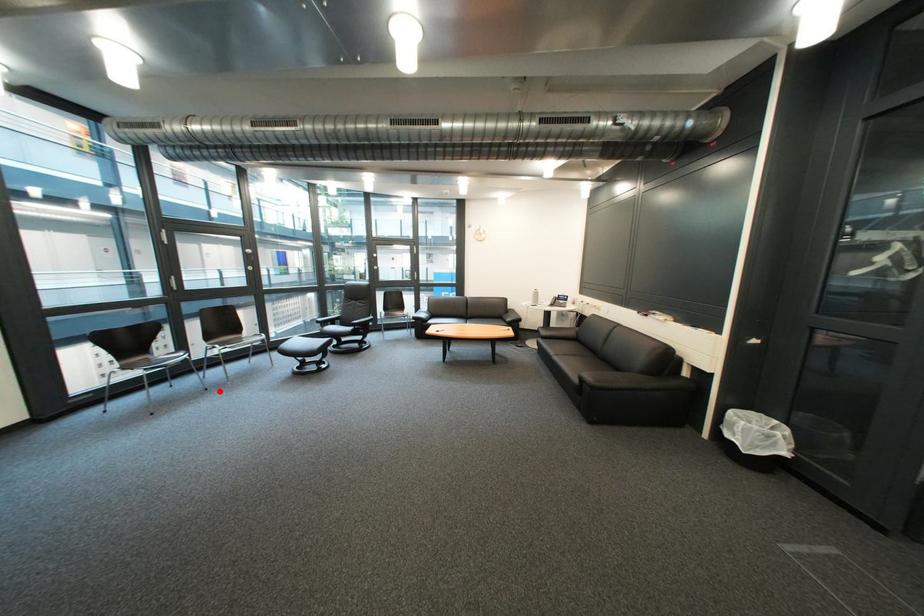
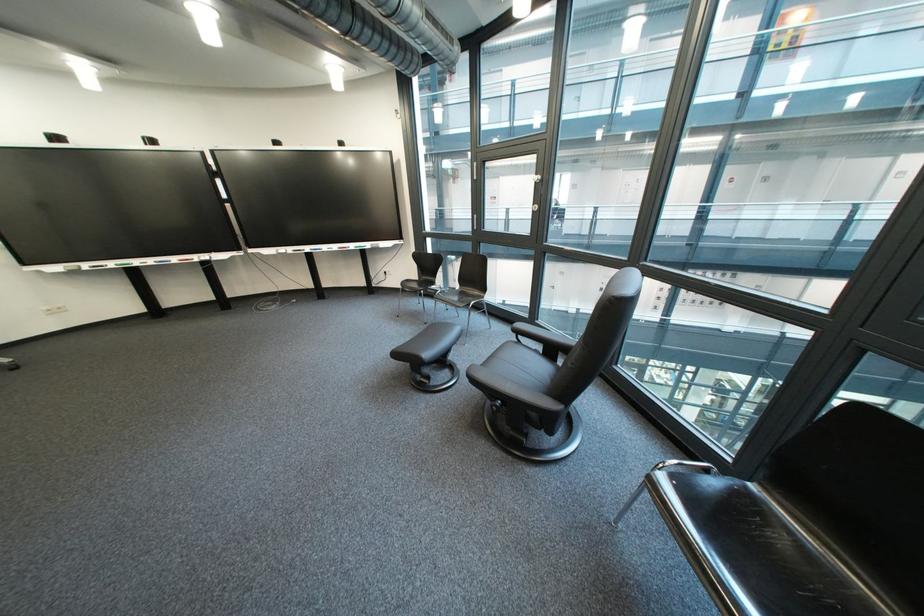
Find the pixel in the second image that matches the highlighted location in the first image.

(439, 325)